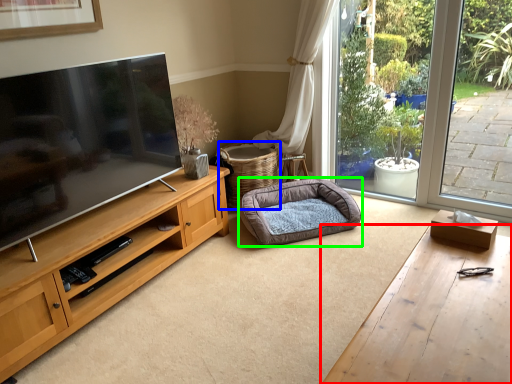
Question: Which object is the closest to the desk (highlighted by a red box)? Choose among these: basket (highlighted by a blue box) or dog bed (highlighted by a green box).

Choices:
 (A) basket
 (B) dog bed

Answer: (B)